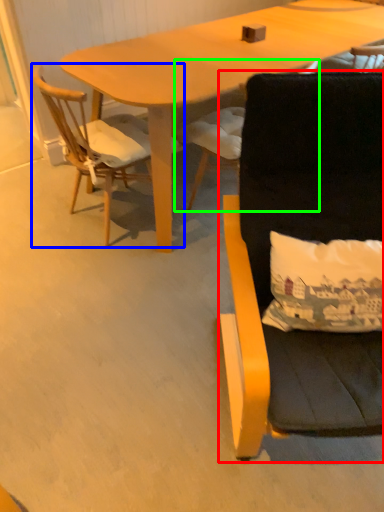
Question: Based on their relative distances, which object is nearer to chair (highlighted by a red box)? Choose from chair (highlighted by a blue box) and chair (highlighted by a green box).

Choices:
 (A) chair
 (B) chair

Answer: (B)